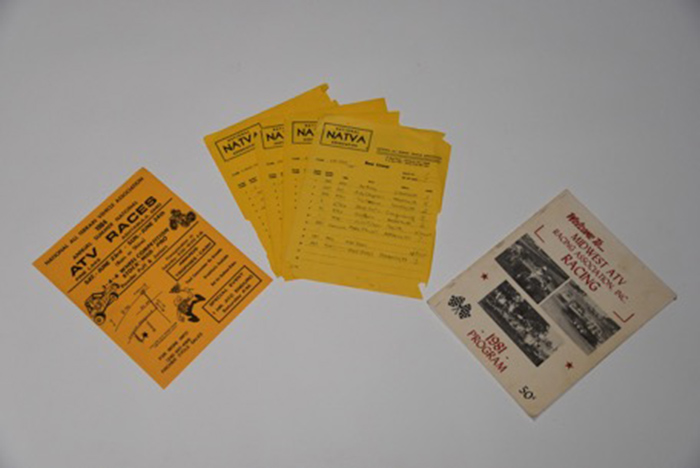
You are a GUI agent. You are given a task and a screenshot of the screen. Output one action in this format:
    pyautogui.click(x=<x>, y=<y>)
    Task: Click on the tabletop
    The width and height of the screenshot is (700, 468).
    Given the screenshot: What is the action you would take?
    pyautogui.click(x=395, y=382)